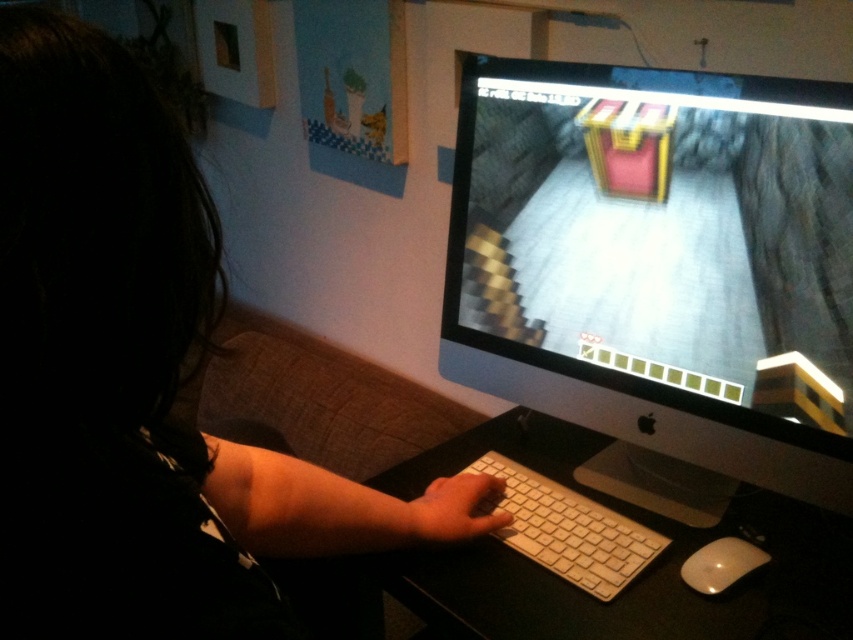
Does black matte keyboard at lower center have a larger size compared to white plastic keyboard at center?

Indeed, black matte keyboard at lower center has a larger size compared to white plastic keyboard at center.

Does black matte keyboard at lower center lie behind white plastic keyboard at center?

No, black matte keyboard at lower center is in front of white plastic keyboard at center.

Which is in front, point (358, 518) or point (474, 604)?

Point (474, 604) is in front.

Find the location of a particular element. The image size is (853, 640). black matte keyboard at lower center is located at coordinates (138, 378).

Is point (157, 584) closer to viewer compared to point (686, 561)?

Yes, point (157, 584) is in front of point (686, 561).

Does black matte keyboard at lower center come behind white glossy mouse at lower right?

No, it is not.

The image size is (853, 640). What are the coordinates of `black matte keyboard at lower center` in the screenshot? It's located at (138, 378).

Between black matte keyboard at lower center and white plastic keyboard at lower center, which one is positioned lower?

white plastic keyboard at lower center is lower down.

Does black matte keyboard at lower center appear over white plastic keyboard at lower center?

Yes, black matte keyboard at lower center is above white plastic keyboard at lower center.

Locate an element on the screen. This screenshot has width=853, height=640. black matte keyboard at lower center is located at coordinates (138, 378).

Find the location of a particular element. The image size is (853, 640). black matte keyboard at lower center is located at coordinates click(x=138, y=378).